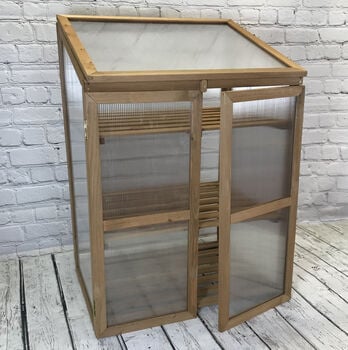
This screenshot has height=350, width=348. In order to click on right door in this screenshot , I will do `click(264, 300)`.